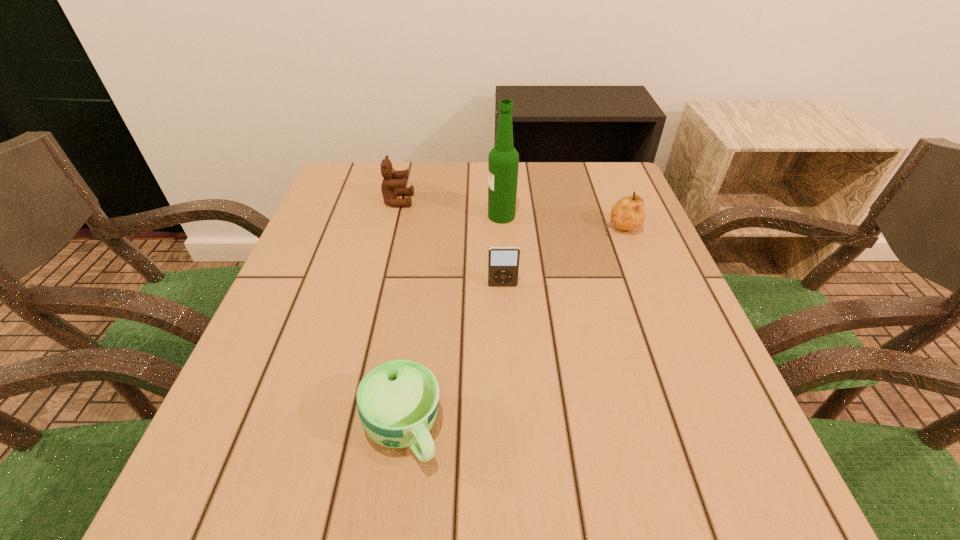
Image resolution: width=960 pixels, height=540 pixels. Find the location of `vacant space at the left edge of the desktop`. vacant space at the left edge of the desktop is located at coordinates (227, 448).

In the image, there is a desktop. What are the coordinates of `vacant space at the right edge` in the screenshot? It's located at (698, 359).

Where is `free space at the far left corner`? free space at the far left corner is located at coordinates (325, 206).

At what (x,y) coordinates should I click in order to perform the action: click on vacant space at the near left corner of the desktop. Please return your answer as a coordinate pair (x, y). Image resolution: width=960 pixels, height=540 pixels. Looking at the image, I should click on (220, 503).

Identify the location of vacant space at the far right corner. (602, 173).

Locate an element on the screen. The height and width of the screenshot is (540, 960). vacant space at the near right corner is located at coordinates [x=658, y=478].

This screenshot has width=960, height=540. Find the location of `vacant region between the beer bottle and the teddy bear`. vacant region between the beer bottle and the teddy bear is located at coordinates (450, 208).

Locate an element on the screen. This screenshot has width=960, height=540. vacant space in between the nearest object and the iPod is located at coordinates (453, 358).

Locate an element on the screen. This screenshot has height=540, width=960. unoccupied area between the nearest object and the rightmost object is located at coordinates (512, 329).

The width and height of the screenshot is (960, 540). In order to click on empty location between the teddy bear and the fourth farthest object in this screenshot , I will do `click(450, 243)`.